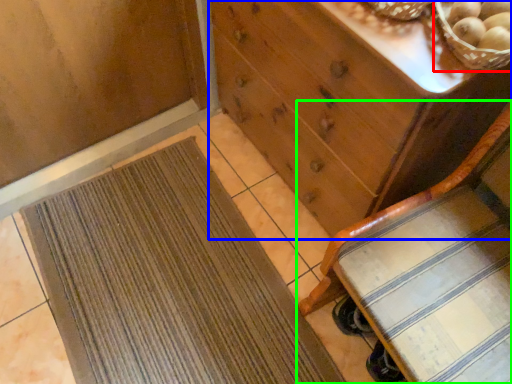
Question: Estimate the real-world distances between objects in this image. Which object is farther from basket (highlighted by a red box), chest of drawers (highlighted by a blue box) or furniture (highlighted by a green box)?

Choices:
 (A) chest of drawers
 (B) furniture

Answer: (B)